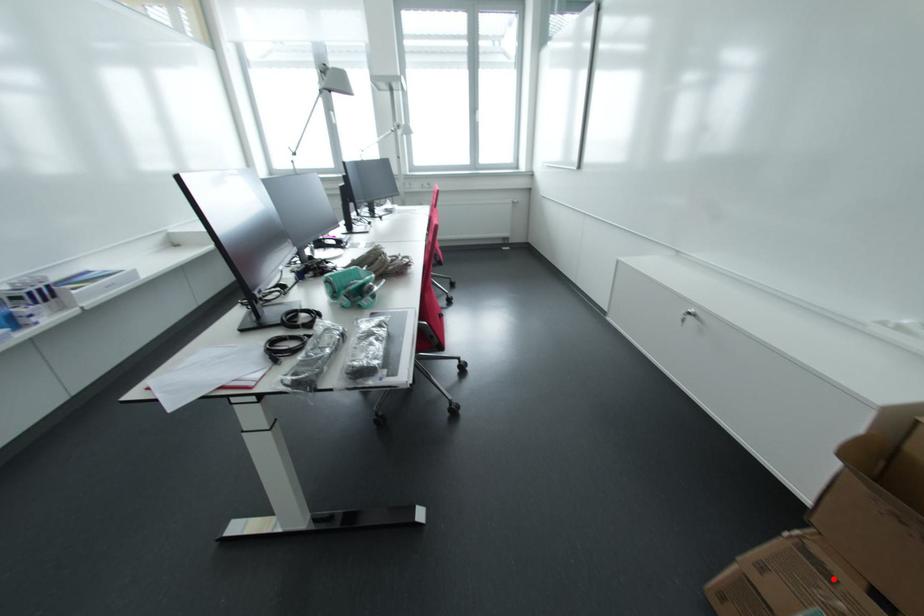
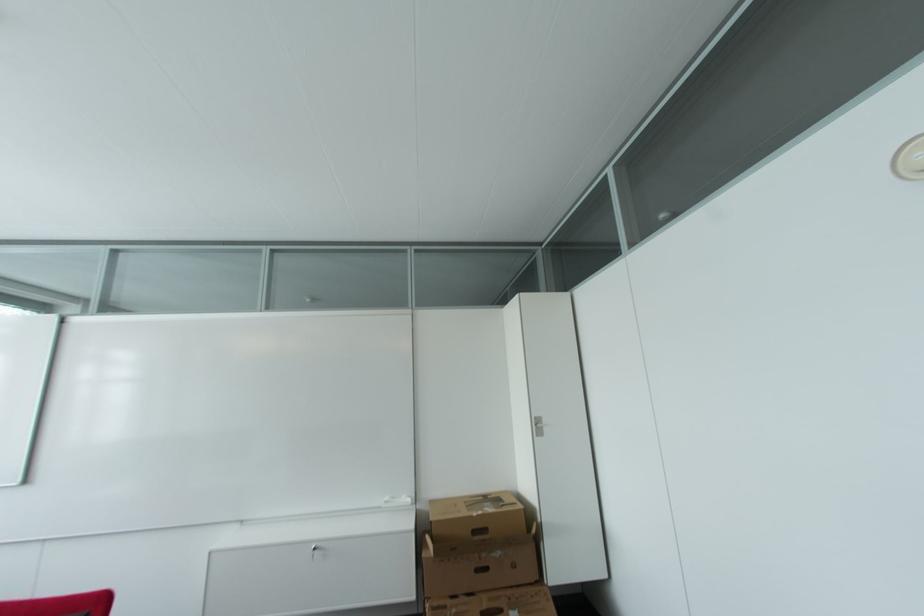
The point at the highlighted location is marked in the first image. Where is the corresponding point in the second image?

(448, 609)